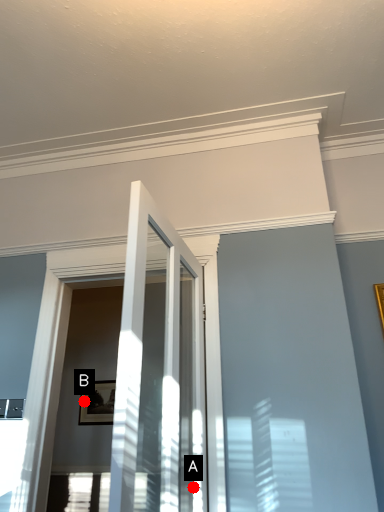
Question: Two points are circled on the image, labeled by A and B beside each circle. Which point is farther from the camera taking this photo?

Choices:
 (A) A is further
 (B) B is further

Answer: (B)